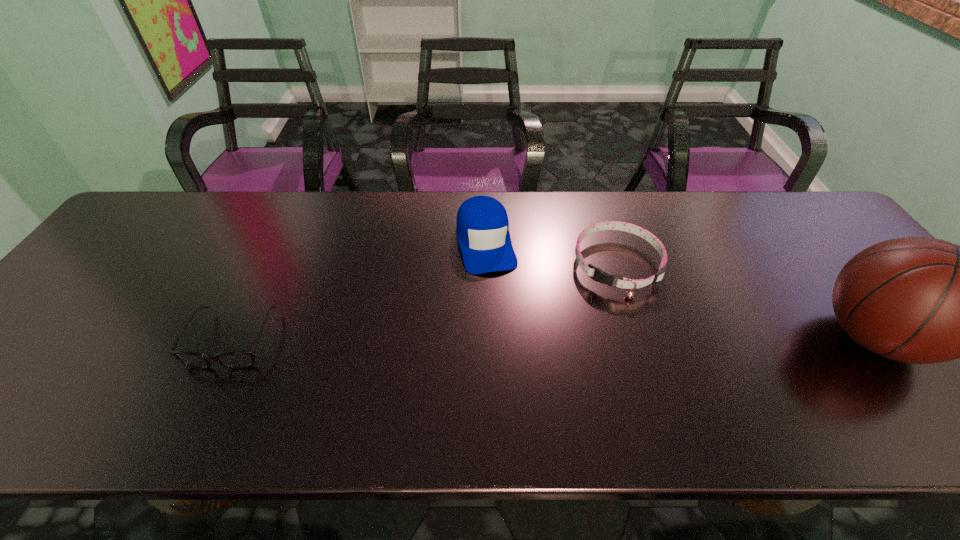
This screenshot has width=960, height=540. I want to click on dog collar located at the far edge, so click(600, 276).

The height and width of the screenshot is (540, 960). Find the location of `baseball cap located at the far edge`. baseball cap located at the far edge is located at coordinates (482, 226).

This screenshot has width=960, height=540. Identify the location of object positioned at the near edge. (233, 359).

Where is `free space at the far edge of the desktop`? Image resolution: width=960 pixels, height=540 pixels. free space at the far edge of the desktop is located at coordinates (530, 192).

The height and width of the screenshot is (540, 960). Identify the location of free space at the near edge of the desktop. (742, 396).

What are the coordinates of `vacant position at the left edge of the desktop` in the screenshot? It's located at (78, 309).

The height and width of the screenshot is (540, 960). I want to click on vacant space at the right edge of the desktop, so click(x=806, y=262).

This screenshot has height=540, width=960. I want to click on empty space between the baseball cap and the dog collar, so click(552, 254).

The width and height of the screenshot is (960, 540). In order to click on vacant space that is in between the dog collar and the spectacles in this screenshot , I will do point(425,303).

Find the location of `unoccupied area between the third object from left to right and the baseball cap`. unoccupied area between the third object from left to right and the baseball cap is located at coordinates (552, 254).